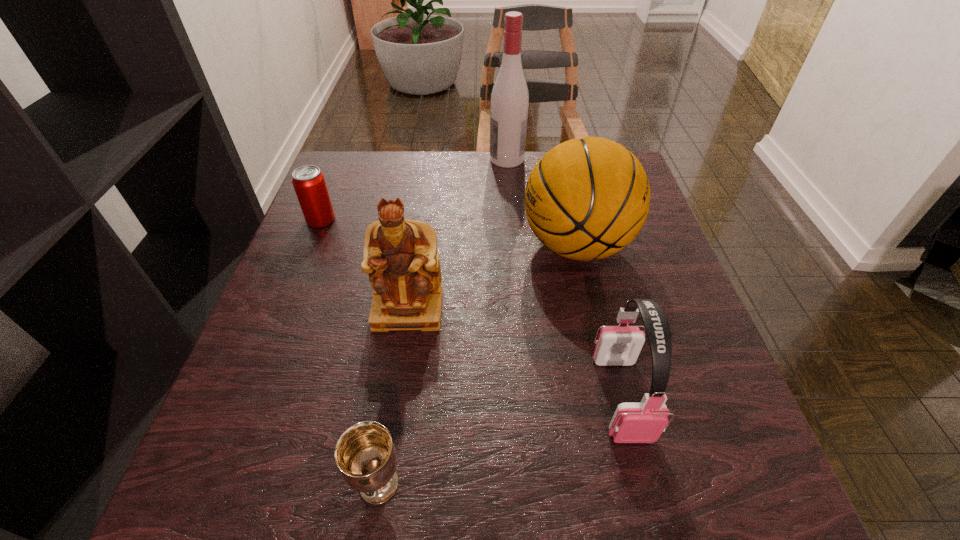
Image resolution: width=960 pixels, height=540 pixels. I want to click on object present at the left edge, so click(309, 183).

This screenshot has height=540, width=960. What are the coordinates of `basketball at the right edge` in the screenshot? It's located at (587, 198).

This screenshot has width=960, height=540. Identify the location of earphone present at the right edge. (644, 422).

The image size is (960, 540). In the image, there is a desktop. Find the location of `vacant space at the far edge`. vacant space at the far edge is located at coordinates 457,158.

In the image, there is a desktop. Identify the location of vacant space at the near edge. (325, 472).

Identify the location of vacant space at the left edge of the desktop. (346, 307).

Where is `vacant space at the right edge of the desktop`? The width and height of the screenshot is (960, 540). vacant space at the right edge of the desktop is located at coordinates (694, 372).

Identify the location of free region at the far left corner of the desktop. (356, 183).

Identify the location of vacant space at the near left corner. (239, 507).

Identify the location of free spot between the chalice and the figurine. (394, 396).